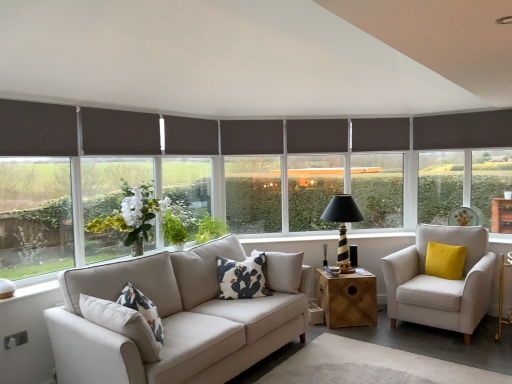
Image resolution: width=512 pixels, height=384 pixels. I want to click on free space above dark gray roller blind at center, the 1th window screen from the back (from a real-world perspective), so pos(246,117).